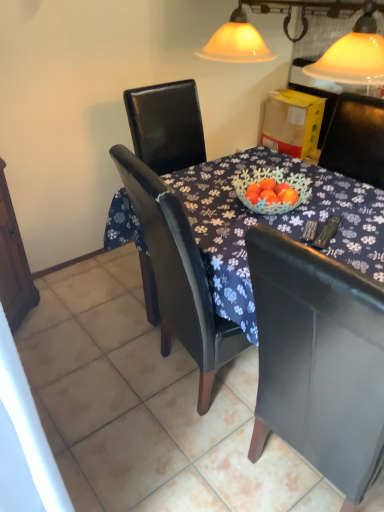
What are the coordinates of `free space to the left of black leather chair at center` in the screenshot? It's located at (157, 459).